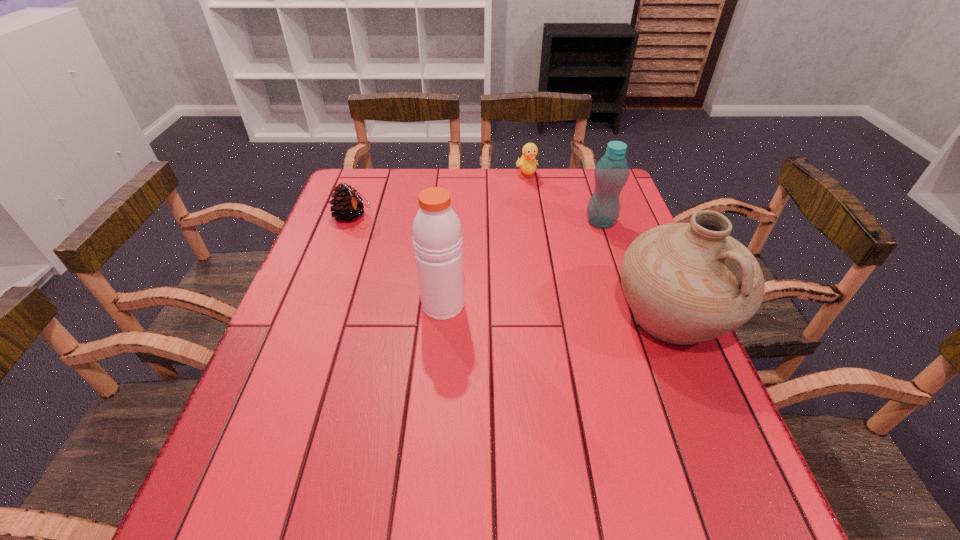
Locate an element on the screen. The height and width of the screenshot is (540, 960). free space that satisfies the following two spatial constraints: 1. on the front side of the water bottle; 2. on the right side of the pottery is located at coordinates (633, 316).

The image size is (960, 540). Find the location of `blank space that satisfies the following two spatial constraints: 1. on the front side of the water bottle; 2. on the right side of the pottery`. blank space that satisfies the following two spatial constraints: 1. on the front side of the water bottle; 2. on the right side of the pottery is located at coordinates (633, 316).

This screenshot has height=540, width=960. What are the coordinates of `vacant space that satisfies the following two spatial constraints: 1. on the front side of the pottery; 2. on the right side of the duckling` in the screenshot? It's located at (548, 316).

At what (x,y) coordinates should I click in order to perform the action: click on vacant position in the image that satisfies the following two spatial constraints: 1. on the front side of the duckling; 2. on the left side of the pottery. Please return your answer as a coordinate pair (x, y). Looking at the image, I should click on (548, 316).